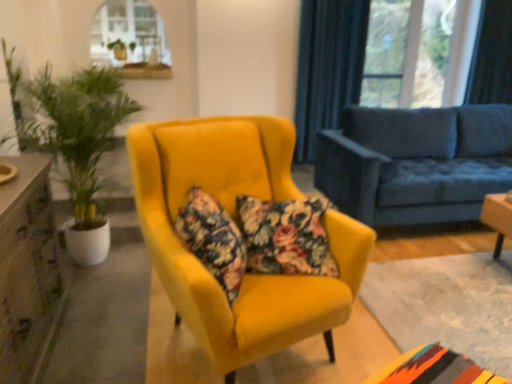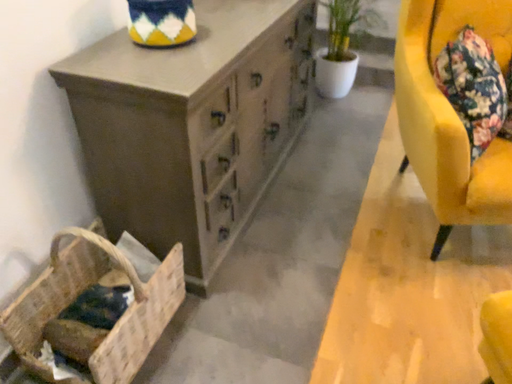
Question: Which way did the camera rotate in the video?

Choices:
 (A) rotated upward
 (B) rotated downward

Answer: (B)